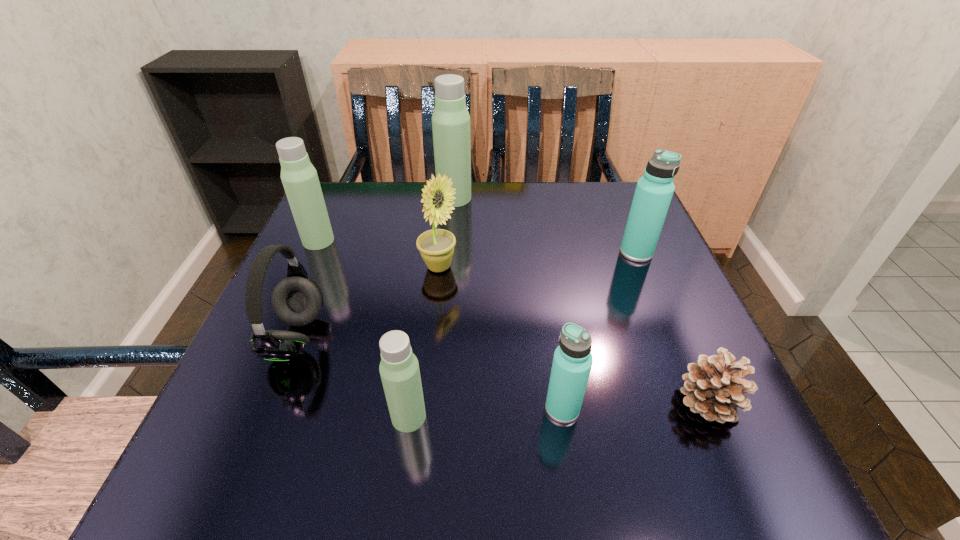
In order to click on free space between the leftmost thermos bottle and the rightmost thermos bottle in this screenshot , I will do `click(477, 247)`.

What are the coordinates of `vacant space that's between the farthest light thermos bottle and the right aqua thermos bottle` in the screenshot? It's located at (545, 225).

Identify the location of vacant area that lies between the pinecone and the sixth object from left to right. Image resolution: width=960 pixels, height=540 pixels. 636,405.

At what (x,y) coordinates should I click in order to perform the action: click on the closest object to the leftmost thermos bottle. Please return your answer as a coordinate pair (x, y). The height and width of the screenshot is (540, 960). Looking at the image, I should click on (297, 300).

Identify the location of the closest object to the sunflower. (297, 300).

Where is `thermos bottle that can be found as the third closest to the black headset`? The width and height of the screenshot is (960, 540). thermos bottle that can be found as the third closest to the black headset is located at coordinates (450, 120).

You are a GUI agent. You are given a task and a screenshot of the screen. Output one action in this format:
    pyautogui.click(x=<x>, y=<y>)
    Task: Click on the second closest thermos bottle to the nearer aqua thermos bottle
    
    Given the screenshot: What is the action you would take?
    pyautogui.click(x=654, y=191)

Locate which light thermos bottle ranks second in proximity to the black headset. Please provide its 2D coordinates. Your answer should be formatted as a tuple, i.e. [(x, y)], where the tuple contains the x and y coordinates of a point satisfying the conditions above.

[(299, 177)]

The height and width of the screenshot is (540, 960). Identify the location of light thermos bottle that stands as the second closest to the farthest thermos bottle. (x=399, y=369).

Identify the location of vacant space that satisfies the following two spatial constraints: 1. on the back side of the pinecone; 2. on the face of the yellow sunflower. (651, 267).